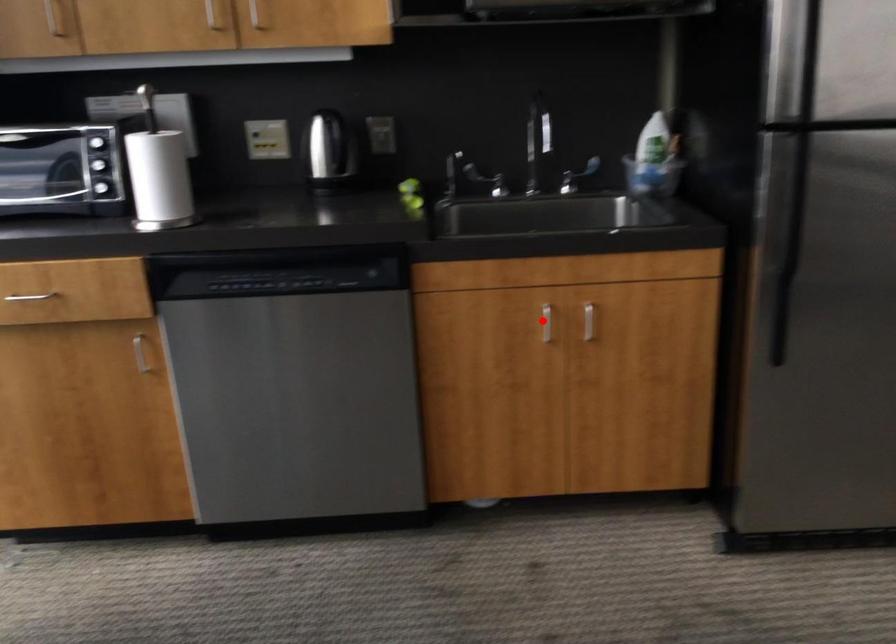
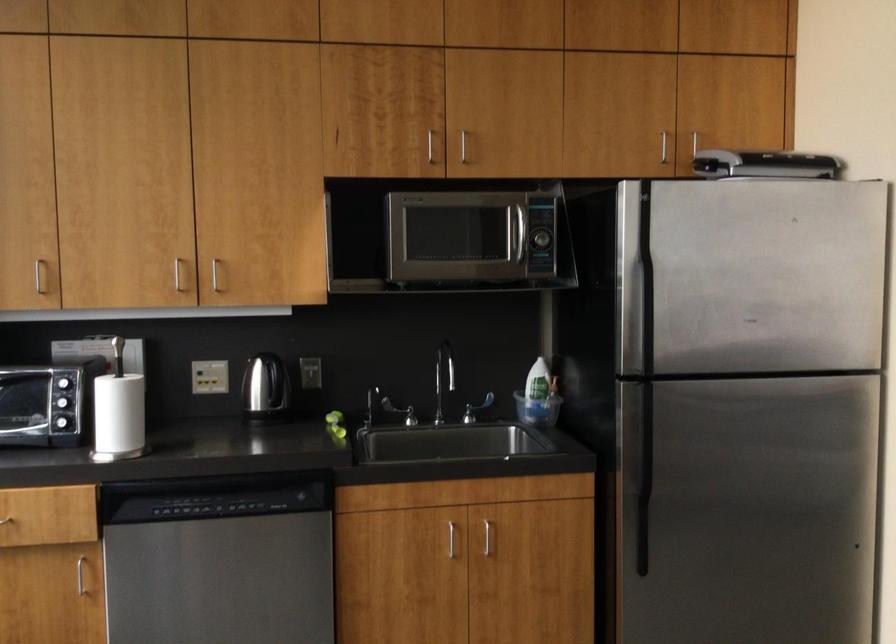
Locate, in the second image, the point that corresponds to the highlighted location in the first image.

(450, 538)